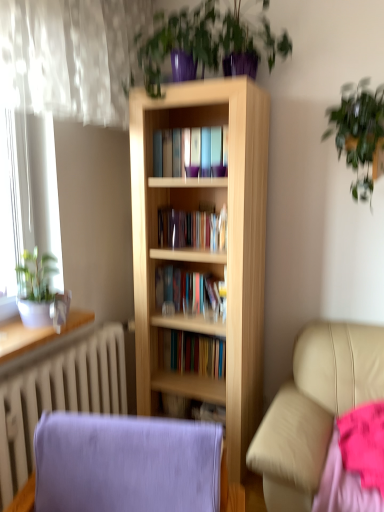
Question: From the image's perspective, would you say purple glossy plant at upper center, which ranks as the second houseplant in left-to-right order, is shown under purple fabric rocking chair at lower left?

Choices:
 (A) yes
 (B) no

Answer: (B)

Question: From the image's perspective, is purple glossy plant at upper center, arranged as the 3th houseplant when ordered from the bottom, on purple fabric rocking chair at lower left?

Choices:
 (A) yes
 (B) no

Answer: (A)

Question: Is purple glossy plant at upper center, which ranks as the second houseplant in left-to-right order, thinner than purple fabric rocking chair at lower left?

Choices:
 (A) yes
 (B) no

Answer: (B)

Question: Considering the relative positions of purple glossy plant at upper center, the first houseplant from the top, and purple fabric rocking chair at lower left in the image provided, is purple glossy plant at upper center, the first houseplant from the top, in front of purple fabric rocking chair at lower left?

Choices:
 (A) yes
 (B) no

Answer: (B)

Question: Is purple glossy plant at upper center, arranged as the 3th houseplant when ordered from the bottom, positioned far away from purple fabric rocking chair at lower left?

Choices:
 (A) yes
 (B) no

Answer: (A)

Question: Is purple glossy plant at upper center, which ranks as the second houseplant in left-to-right order, located outside purple fabric rocking chair at lower left?

Choices:
 (A) yes
 (B) no

Answer: (A)

Question: Could you tell me if purple glossy plant at upper center, which is counted as the second houseplant, starting from the right, is turned towards white glossy radiator at lower left?

Choices:
 (A) no
 (B) yes

Answer: (A)

Question: Is purple glossy plant at upper center, the first houseplant from the top, behind white glossy radiator at lower left?

Choices:
 (A) yes
 (B) no

Answer: (A)

Question: Considering the relative sizes of purple glossy plant at upper center, arranged as the 3th houseplant when ordered from the bottom, and white glossy radiator at lower left in the image provided, is purple glossy plant at upper center, arranged as the 3th houseplant when ordered from the bottom, thinner than white glossy radiator at lower left?

Choices:
 (A) no
 (B) yes

Answer: (A)

Question: Is purple glossy plant at upper center, which is counted as the second houseplant, starting from the right, not close to white glossy radiator at lower left?

Choices:
 (A) yes
 (B) no

Answer: (A)

Question: Does purple glossy plant at upper center, which is counted as the second houseplant, starting from the right, contain white glossy radiator at lower left?

Choices:
 (A) yes
 (B) no

Answer: (B)

Question: From a real-world perspective, is purple glossy plant at upper center, which is counted as the second houseplant, starting from the right, located beneath white glossy radiator at lower left?

Choices:
 (A) no
 (B) yes

Answer: (A)

Question: Does light wood bookcase at center come behind white glossy radiator at lower left?

Choices:
 (A) yes
 (B) no

Answer: (A)